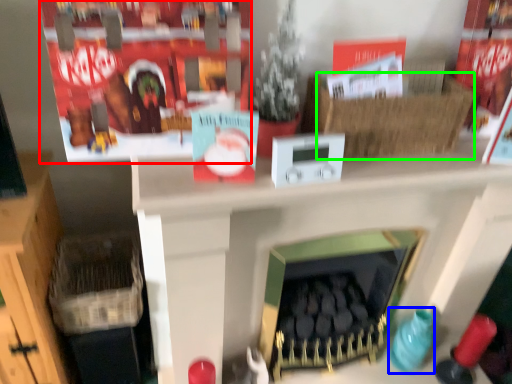
Question: Estimate the real-world distances between objects in this image. Which object is closer to shelf (highlighted by a red box), toy (highlighted by a blue box) or basket (highlighted by a green box)?

Choices:
 (A) toy
 (B) basket

Answer: (B)